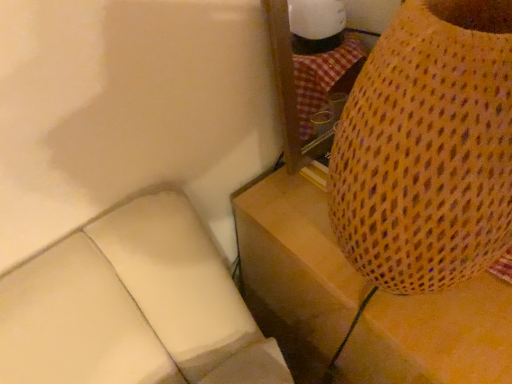
This screenshot has width=512, height=384. I want to click on free spot below orange mesh lampshade at right (from a real-world perspective), so click(x=399, y=306).